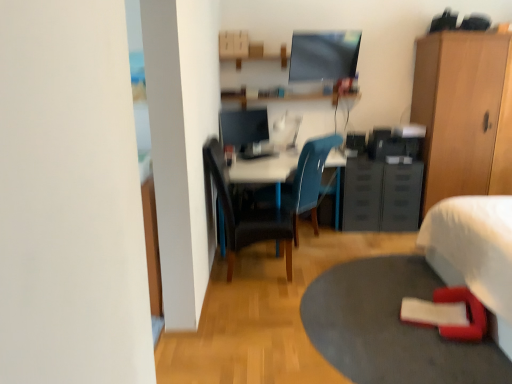
Question: Considering the positions of satin black monitor at center and black leather chair at center, placed as the first chair when sorted from front to back, in the image, is satin black monitor at center bigger or smaller than black leather chair at center, placed as the first chair when sorted from front to back,?

Choices:
 (A) small
 (B) big

Answer: (A)

Question: In the image, is satin black monitor at center on the left side or the right side of black leather chair at center, which appears as the 2th chair when viewed from the back?

Choices:
 (A) right
 (B) left

Answer: (B)

Question: Considering the real-world distances, which object is farthest from the black plastic file cabinet at center-right?

Choices:
 (A) wooden cabinet at right
 (B) black plastic drawer at center-right
 (C) satin black monitor at center
 (D) rubberized red mat at lower right
 (E) matte blue chair at center, which is the first chair from back to front

Answer: (C)

Question: Which object is positioned farthest from the satin black monitor at center?

Choices:
 (A) black plastic drawer at center-right
 (B) rubberized red mat at lower right
 (C) matte blue chair at center, which ranks as the second chair in front-to-back order
 (D) white glossy computer desk at center
 (E) black leather chair at center, which appears as the 2th chair when viewed from the back

Answer: (B)